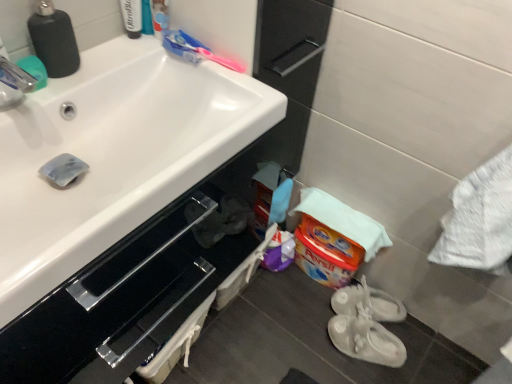
Image resolution: width=512 pixels, height=384 pixels. Find the location of `vacant region in front of white rubber shoes at lower right, which is the 2th footwear from back to front`. vacant region in front of white rubber shoes at lower right, which is the 2th footwear from back to front is located at coordinates (367, 374).